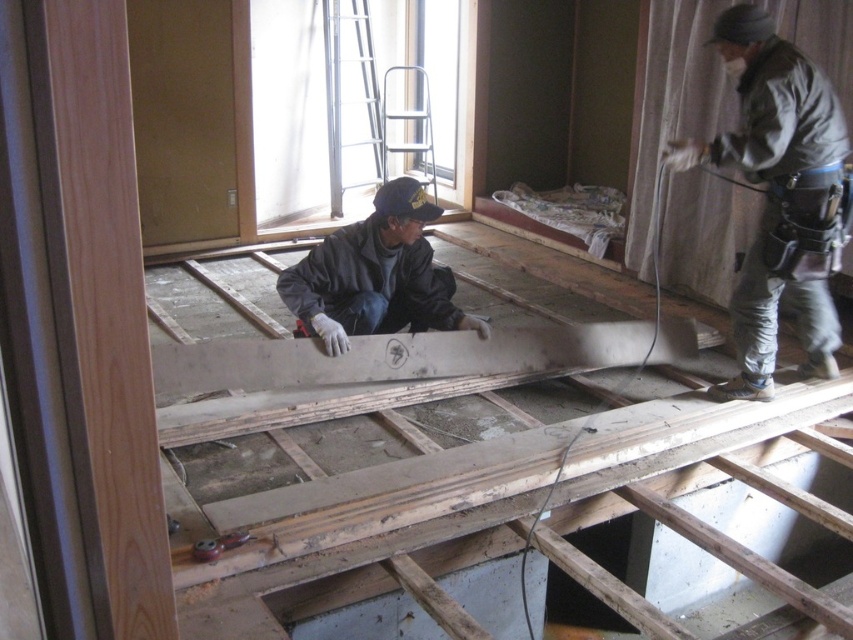
Question: Observing the image, what is the correct spatial positioning of black matte jacket at center in reference to metallic silver ladder at upper center?

Choices:
 (A) below
 (B) above

Answer: (A)

Question: Which point is farther to the camera?

Choices:
 (A) metallic silver ladder at upper center
 (B) black matte jacket at center
 (C) gray fabric construction worker at right

Answer: (A)

Question: Which of the following is the closest to the observer?

Choices:
 (A) (375, 307)
 (B) (386, 125)

Answer: (A)

Question: Is black matte jacket at center smaller than metallic silver ladder at upper center?

Choices:
 (A) yes
 (B) no

Answer: (A)

Question: Can you confirm if black matte jacket at center is positioned above metallic silver ladder at upper center?

Choices:
 (A) yes
 (B) no

Answer: (B)

Question: Which object is the closest to the black matte jacket at center?

Choices:
 (A) gray fabric construction worker at right
 (B) metallic silver ladder at upper center

Answer: (A)